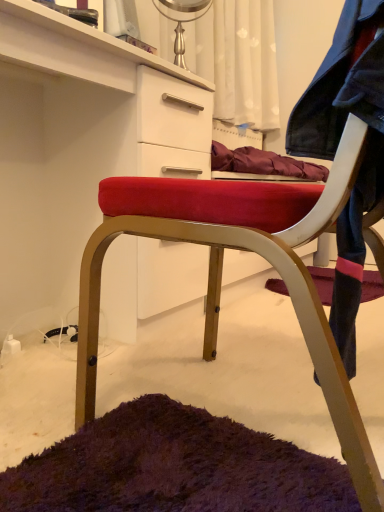
Question: Considering the positions of velvet red chair at center and velvet red chair at center in the image, is velvet red chair at center taller or shorter than velvet red chair at center?

Choices:
 (A) short
 (B) tall

Answer: (B)

Question: Is velvet red chair at center bigger or smaller than velvet red chair at center?

Choices:
 (A) small
 (B) big

Answer: (A)

Question: Which object is the closest to the velvet red chair at center?

Choices:
 (A) faded denim jacket at lower right
 (B) velvet red chair at center

Answer: (A)

Question: Which object is the closest to the velvet red chair at center?

Choices:
 (A) faded denim jacket at lower right
 (B) velvet red chair at center

Answer: (A)